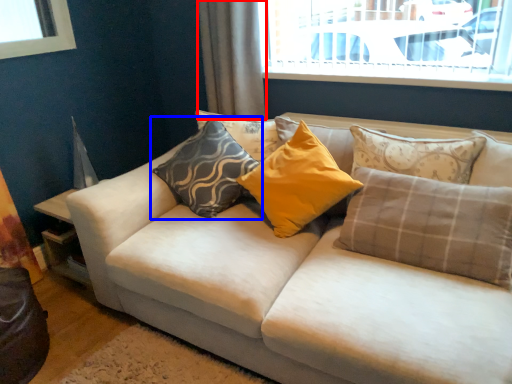
Question: Among these objects, which one is nearest to the camera, curtain (highlighted by a red box) or pillow (highlighted by a blue box)?

Choices:
 (A) curtain
 (B) pillow

Answer: (B)